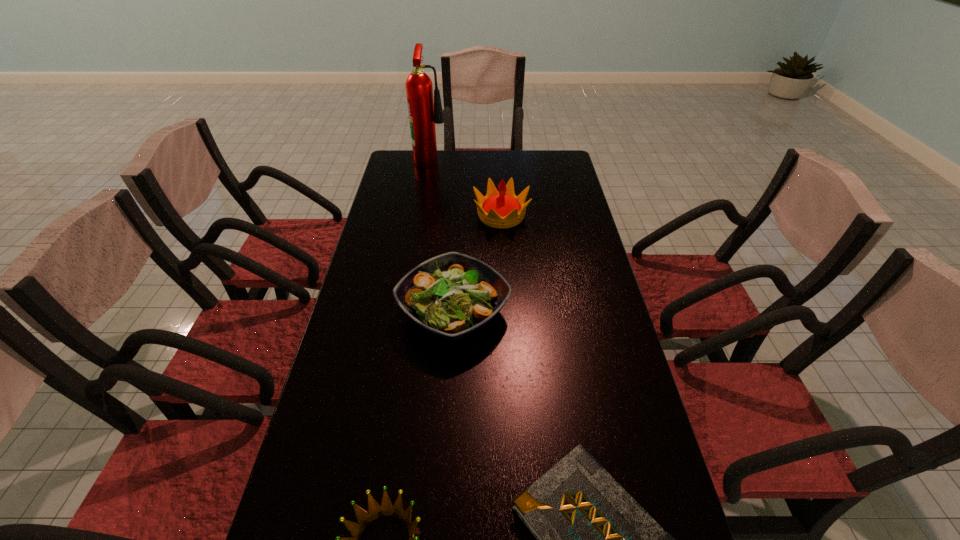
Where is `free location that satisfies the following two spatial constraints: 1. on the back side of the right crown; 2. at the nozzle of the fire extinguisher`? The height and width of the screenshot is (540, 960). free location that satisfies the following two spatial constraints: 1. on the back side of the right crown; 2. at the nozzle of the fire extinguisher is located at coordinates (498, 159).

Find the location of `free space that satisfies the following two spatial constraints: 1. at the nozzle of the tallest object; 2. on the back side of the salad plate`. free space that satisfies the following two spatial constraints: 1. at the nozzle of the tallest object; 2. on the back side of the salad plate is located at coordinates (406, 312).